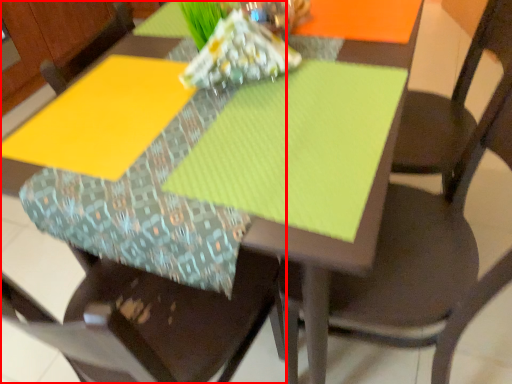
Question: From the image's perspective, what is the correct spatial positioning of chair (annotated by the red box) in reference to chair?

Choices:
 (A) below
 (B) above

Answer: (A)